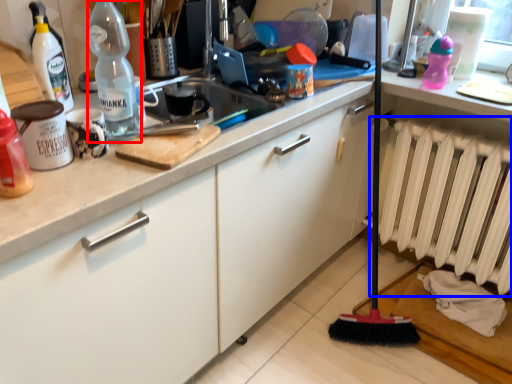
Question: Which of the following is the closest to the observer, bottle (highlighted by a red box) or radiator (highlighted by a blue box)?

Choices:
 (A) bottle
 (B) radiator

Answer: (A)